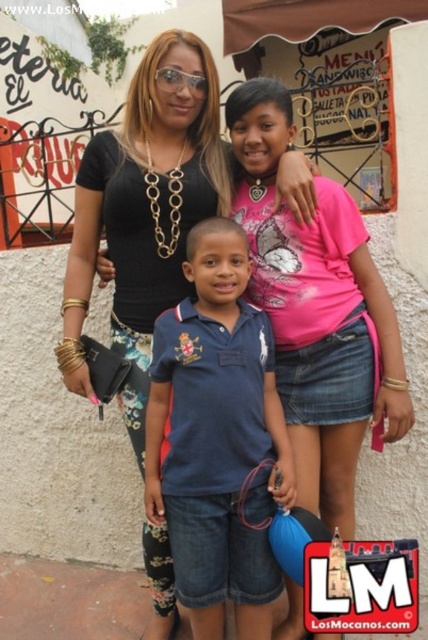
You are a photographer trying to decide which of the two shirts at the center of the image to focus on for a closeup shot. The pink matte shirt at center and the black matte shirt at center are both in the frame. Which shirt should you choose to capture more details if you want to focus on the larger one?

The pink matte shirt at center is bigger than the black matte shirt at center, so you should focus on the pink matte shirt at center to capture more details.

You are a photographer trying to capture a clear shot of the blue cotton polo shirt at center and the black matte shirt at center. Which one is positioned lower in the frame?

The blue cotton polo shirt at center is positioned lower in the frame than the black matte shirt at center.